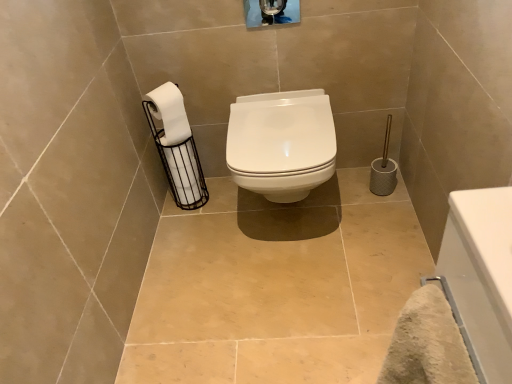
Locate an element on the screen. This screenshot has width=512, height=384. white glossy toilet at center is located at coordinates (281, 143).

You are a GUI agent. You are given a task and a screenshot of the screen. Output one action in this format:
    pyautogui.click(x=<x>, y=<y>)
    Task: Click on the white glossy bathtub at lower right
    The image size is (512, 384).
    Given the screenshot: What is the action you would take?
    pyautogui.click(x=480, y=277)

Is white matte toilet paper at left, the 2th toilet paper viewed from the front, with white glossy toilet at center?

white matte toilet paper at left, the 2th toilet paper viewed from the front, and white glossy toilet at center are clearly separated.

Where is `toilet on the right of white matte toilet paper at left, positioned as the 1th toilet paper in back-to-front order`? The height and width of the screenshot is (384, 512). toilet on the right of white matte toilet paper at left, positioned as the 1th toilet paper in back-to-front order is located at coordinates (281, 143).

Which object is positioned more to the right, white matte toilet paper at left, the 2th toilet paper viewed from the front, or white glossy toilet at center?

white glossy toilet at center is more to the right.

In terms of width, does white glossy bathtub at lower right look wider or thinner when compared to white matte toilet paper at left, the 2th toilet paper viewed from the front?

In the image, white glossy bathtub at lower right appears to be wider than white matte toilet paper at left, the 2th toilet paper viewed from the front.

Which of these two, white glossy bathtub at lower right or white matte toilet paper at left, the 2th toilet paper viewed from the front, is smaller?

Smaller between the two is white matte toilet paper at left, the 2th toilet paper viewed from the front.

Based on the photo, from a real-world perspective, who is located higher, white glossy bathtub at lower right or white matte toilet paper at left, positioned as the 1th toilet paper in back-to-front order?

white glossy bathtub at lower right.

Between white glossy bathtub at lower right and white matte toilet paper at left, positioned as the 1th toilet paper in back-to-front order, which one is positioned in front?

Positioned in front is white glossy bathtub at lower right.

Consider the image. Which is closer to the camera, (471, 197) or (243, 128)?

Clearly, point (471, 197) is closer to the camera than point (243, 128).

Is white glossy toilet at center inside white glossy bathtub at lower right?

Actually, white glossy toilet at center is outside white glossy bathtub at lower right.

From a real-world perspective, who is located lower, white glossy bathtub at lower right or white glossy toilet at center?

In real-world perspective, white glossy toilet at center is lower.

Could you tell me if white glossy toilet at center is turned towards white matte toilet paper at left, which is counted as the second toilet paper, starting from the back?

No, white glossy toilet at center is not aimed at white matte toilet paper at left, which is counted as the second toilet paper, starting from the back.

Relative to white matte toilet paper at left, marked as the first toilet paper in a front-to-back arrangement, is white glossy toilet at center in front or behind?

Clearly, white glossy toilet at center is in front of white matte toilet paper at left, marked as the first toilet paper in a front-to-back arrangement.

Based on their positions, is white glossy toilet at center located to the left or right of white matte toilet paper at left, marked as the first toilet paper in a front-to-back arrangement?

white glossy toilet at center is positioned on white matte toilet paper at left, marked as the first toilet paper in a front-to-back arrangement,'s right side.

Is white glossy toilet at center not within white matte toilet paper at left, which is counted as the second toilet paper, starting from the back?

That's correct, white glossy toilet at center is outside of white matte toilet paper at left, which is counted as the second toilet paper, starting from the back.

Considering the relative positions of white matte toilet paper at left, which is counted as the second toilet paper, starting from the back, and white glossy bathtub at lower right in the image provided, is white matte toilet paper at left, which is counted as the second toilet paper, starting from the back, to the left or to the right of white glossy bathtub at lower right?

In the image, white matte toilet paper at left, which is counted as the second toilet paper, starting from the back, appears on the left side of white glossy bathtub at lower right.

Is white matte toilet paper at left, which is counted as the second toilet paper, starting from the back, further to the viewer compared to white glossy bathtub at lower right?

Yes, white matte toilet paper at left, which is counted as the second toilet paper, starting from the back, is further from the camera.

Does white matte toilet paper at left, marked as the first toilet paper in a front-to-back arrangement, have a lesser height compared to white glossy bathtub at lower right?

Yes.

Looking at the image, does white matte toilet paper at left, which is counted as the second toilet paper, starting from the back, seem bigger or smaller compared to white glossy bathtub at lower right?

white matte toilet paper at left, which is counted as the second toilet paper, starting from the back, is smaller than white glossy bathtub at lower right.

Would you say white glossy bathtub at lower right is part of white matte toilet paper at left, the 2th toilet paper viewed from the front,'s contents?

Actually, white glossy bathtub at lower right is outside white matte toilet paper at left, the 2th toilet paper viewed from the front.

From a real-world perspective, is white matte toilet paper at left, the 2th toilet paper viewed from the front, positioned above or below white glossy bathtub at lower right?

Clearly, from a real-world perspective, white matte toilet paper at left, the 2th toilet paper viewed from the front, is below white glossy bathtub at lower right.

From the image's perspective, between white glossy toilet at center and white matte toilet paper at left, the 2th toilet paper viewed from the front, who is located below?

white matte toilet paper at left, the 2th toilet paper viewed from the front, appears lower in the image.

From a real-world perspective, which object rests below the other?

white matte toilet paper at left, positioned as the 1th toilet paper in back-to-front order, is physically lower.

Can you confirm if white glossy toilet at center is bigger than white matte toilet paper at left, the 2th toilet paper viewed from the front?

Indeed, white glossy toilet at center has a larger size compared to white matte toilet paper at left, the 2th toilet paper viewed from the front.

Considering the sizes of objects white glossy toilet at center and white matte toilet paper at left, positioned as the 1th toilet paper in back-to-front order, in the image provided, who is shorter, white glossy toilet at center or white matte toilet paper at left, positioned as the 1th toilet paper in back-to-front order,?

white glossy toilet at center is shorter.

From the white glossy toilet at center, count 2nd toilet papers backward and point to it. Please provide its 2D coordinates.

[(176, 146)]

This screenshot has width=512, height=384. Identify the location of bath on the right of white matte toilet paper at left, the 2th toilet paper viewed from the front. coord(480,277).

Based on their spatial positions, is white matte toilet paper at left, which is counted as the second toilet paper, starting from the back, or white glossy bathtub at lower right further from white matte toilet paper at left, positioned as the 1th toilet paper in back-to-front order?

Based on the image, white glossy bathtub at lower right appears to be further to white matte toilet paper at left, positioned as the 1th toilet paper in back-to-front order.

Looking at the image, which one is located closer to white matte toilet paper at left, which is counted as the second toilet paper, starting from the back, white matte toilet paper at left, the 2th toilet paper viewed from the front, or white glossy bathtub at lower right?

white matte toilet paper at left, the 2th toilet paper viewed from the front, is positioned closer to the anchor white matte toilet paper at left, which is counted as the second toilet paper, starting from the back.

Which object lies nearer to the anchor point white glossy toilet at center, white matte toilet paper at left, the 2th toilet paper viewed from the front, or white glossy bathtub at lower right?

Based on the image, white matte toilet paper at left, the 2th toilet paper viewed from the front, appears to be nearer to white glossy toilet at center.

Considering their positions, is white matte toilet paper at left, marked as the first toilet paper in a front-to-back arrangement, positioned closer to white glossy toilet at center than white matte toilet paper at left, positioned as the 1th toilet paper in back-to-front order?

Based on the image, white matte toilet paper at left, positioned as the 1th toilet paper in back-to-front order, appears to be nearer to white glossy toilet at center.

Estimate the real-world distances between objects in this image. Which object is closer to white matte toilet paper at left, marked as the first toilet paper in a front-to-back arrangement, white glossy toilet at center or white glossy bathtub at lower right?

white glossy toilet at center is closer to white matte toilet paper at left, marked as the first toilet paper in a front-to-back arrangement.

Based on their spatial positions, is white matte toilet paper at left, the 2th toilet paper viewed from the front, or white matte toilet paper at left, marked as the first toilet paper in a front-to-back arrangement, closer to white glossy toilet at center?

Based on the image, white matte toilet paper at left, the 2th toilet paper viewed from the front, appears to be nearer to white glossy toilet at center.

Looking at the image, which one is located closer to white matte toilet paper at left, the 2th toilet paper viewed from the front, white glossy toilet at center or white matte toilet paper at left, which is counted as the second toilet paper, starting from the back?

white matte toilet paper at left, which is counted as the second toilet paper, starting from the back, is closer to white matte toilet paper at left, the 2th toilet paper viewed from the front.

Estimate the real-world distances between objects in this image. Which object is further from white matte toilet paper at left, positioned as the 1th toilet paper in back-to-front order, white glossy bathtub at lower right or white matte toilet paper at left, which is counted as the second toilet paper, starting from the back?

white glossy bathtub at lower right.

You are a GUI agent. You are given a task and a screenshot of the screen. Output one action in this format:
    pyautogui.click(x=<x>, y=<y>)
    Task: Click on the toilet located between white glossy bathtub at lower right and white matte toilet paper at left, positioned as the 1th toilet paper in back-to-front order, in the depth direction
    This screenshot has height=384, width=512.
    Given the screenshot: What is the action you would take?
    pyautogui.click(x=281, y=143)

Image resolution: width=512 pixels, height=384 pixels. In order to click on toilet paper situated between white matte toilet paper at left, marked as the first toilet paper in a front-to-back arrangement, and white glossy toilet at center from left to right in this screenshot , I will do `click(176, 146)`.

You are a GUI agent. You are given a task and a screenshot of the screen. Output one action in this format:
    pyautogui.click(x=<x>, y=<y>)
    Task: Click on the toilet positioned between white glossy bathtub at lower right and white matte toilet paper at left, which is counted as the second toilet paper, starting from the back, from near to far
    
    Given the screenshot: What is the action you would take?
    pyautogui.click(x=281, y=143)

Where is `toilet paper between white glossy bathtub at lower right and white matte toilet paper at left, positioned as the 1th toilet paper in back-to-front order, in the front-back direction`? toilet paper between white glossy bathtub at lower right and white matte toilet paper at left, positioned as the 1th toilet paper in back-to-front order, in the front-back direction is located at coordinates (169, 113).